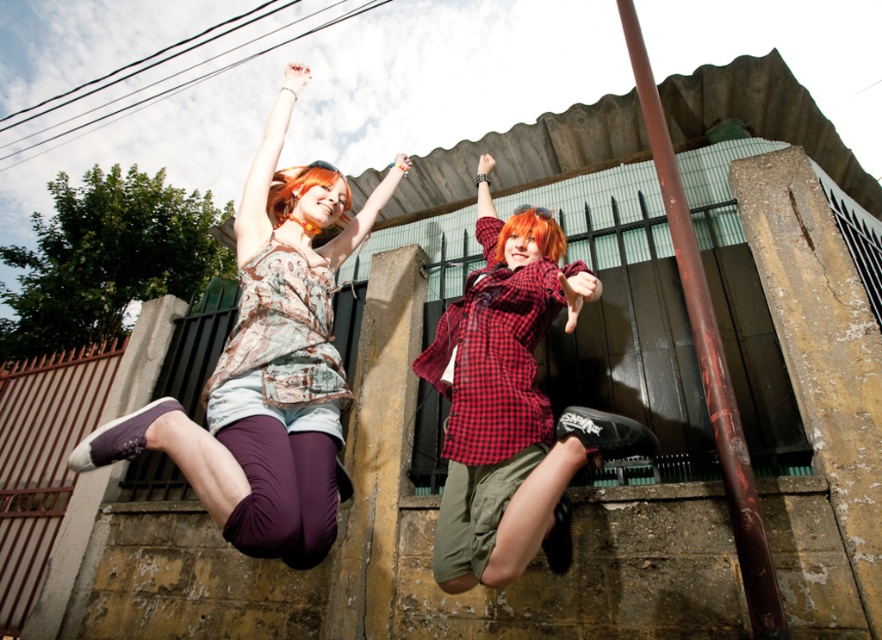
Question: Does matte brown tank top at upper left lie behind red checkered shirt at center?

Choices:
 (A) yes
 (B) no

Answer: (B)

Question: Which object is closer to the camera taking this photo?

Choices:
 (A) orange dyed hair at upper center
 (B) orange matte hair at center
 (C) smooth brown pole at upper right
 (D) red checkered shirt at center

Answer: (C)

Question: Is matte brown tank top at upper left further to the viewer compared to smooth brown pole at upper right?

Choices:
 (A) no
 (B) yes

Answer: (B)

Question: Can you confirm if red checkered shirt at center is positioned above smooth brown pole at upper right?

Choices:
 (A) yes
 (B) no

Answer: (B)

Question: Which point is closer to the camera taking this photo?

Choices:
 (A) (531, 307)
 (B) (507, 227)

Answer: (A)

Question: Which object is the closest to the matte brown tank top at upper left?

Choices:
 (A) smooth brown pole at upper right
 (B) orange matte hair at center
 (C) red checkered shirt at center

Answer: (C)